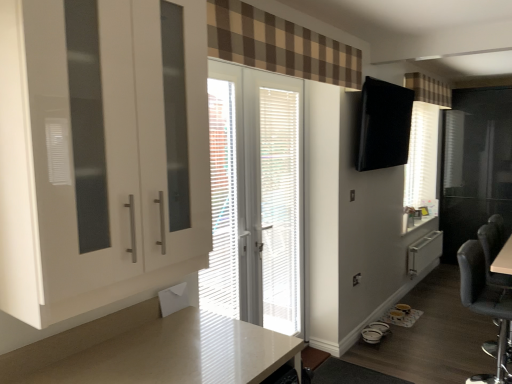
Identify the location of free spot below white glossy cabinet at left (from a real-world perspective). (125, 352).